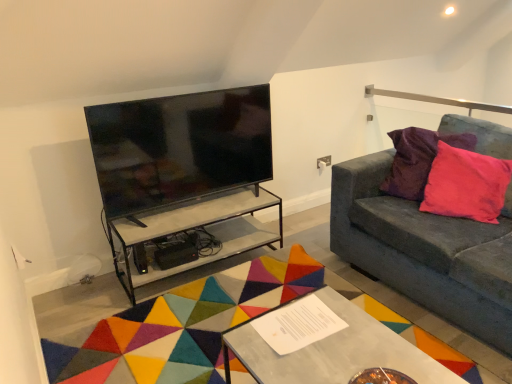
What is the approximate height of pink velvet cushion at right?

59.12 centimeters.

The image size is (512, 384). Find the location of `pink velvet cushion at right`. pink velvet cushion at right is located at coordinates (466, 184).

Find the location of a particular element. velvet grey couch at right is located at coordinates (425, 250).

I want to click on multicolored felt mat at center, so click(x=180, y=326).

Measure the distance between pink velvet pillow at right and camera.

A distance of 2.43 meters exists between pink velvet pillow at right and camera.

Find the location of a particular element. The image size is (512, 384). white paper at center is located at coordinates [x=298, y=324].

What do you see at coordinates (179, 147) in the screenshot? I see `black glossy tv at upper left` at bounding box center [179, 147].

At what (x,y) coordinates should I click in order to perform the action: click on pink velvet cushion at right. Please return your answer as a coordinate pair (x, y). Image resolution: width=512 pixels, height=384 pixels. Looking at the image, I should click on (466, 184).

Is pink velvet cushion at right taller than black glossy tv at upper left?

No, pink velvet cushion at right is not taller than black glossy tv at upper left.

Is pink velvet cushion at right positioned before black glossy tv at upper left?

No, pink velvet cushion at right is further to the viewer.

Identify the location of throw pillow below the black glossy tv at upper left (from a real-world perspective). This screenshot has width=512, height=384. (466, 184).

Are pink velvet cushion at right and black glossy tv at upper left far apart?

pink velvet cushion at right is far away from black glossy tv at upper left.

From a real-world perspective, is metallic silver table at center, which is the first table in front-to-back order, physically located above or below multicolored felt mat at center?

From a real-world perspective, metallic silver table at center, which is the first table in front-to-back order, is physically above multicolored felt mat at center.

From the picture: From the image's perspective, is metallic silver table at center, which is the first table in front-to-back order, located above or below multicolored felt mat at center?

Based on their image positions, metallic silver table at center, which is the first table in front-to-back order, is located above multicolored felt mat at center.

Considering the sizes of objects metallic silver table at center, the second table viewed from the back, and multicolored felt mat at center in the image provided, who is shorter, metallic silver table at center, the second table viewed from the back, or multicolored felt mat at center?

With less height is multicolored felt mat at center.

Is metallic silver table at center, which is the first table in front-to-back order, positioned with its back to multicolored felt mat at center?

Yes.

Does multicolored felt mat at center appear on the left side of clear glass table at center, which appears as the first table when viewed from the back?

In fact, multicolored felt mat at center is to the right of clear glass table at center, which appears as the first table when viewed from the back.

Is multicolored felt mat at center not close to clear glass table at center, the 2th table viewed from the front?

multicolored felt mat at center is near clear glass table at center, the 2th table viewed from the front, not far away.

Considering the relative sizes of multicolored felt mat at center and clear glass table at center, the 2th table viewed from the front, in the image provided, is multicolored felt mat at center shorter than clear glass table at center, the 2th table viewed from the front,?

Correct, multicolored felt mat at center is not as tall as clear glass table at center, the 2th table viewed from the front.

Which is in front, multicolored felt mat at center or clear glass table at center, which appears as the first table when viewed from the back?

multicolored felt mat at center.

Looking at this image, considering the positions of objects multicolored felt mat at center and black glossy tv at upper left in the image provided, who is in front, multicolored felt mat at center or black glossy tv at upper left?

multicolored felt mat at center is in front.

In the image, there is a black glossy tv at upper left. Identify the location of mat below it (from the image's perspective). (180, 326).

Is multicolored felt mat at center facing away from black glossy tv at upper left?

No.

Would you say multicolored felt mat at center is inside or outside black glossy tv at upper left?

The correct answer is: outside.

From the image's perspective, which object appears higher, white paper at center or black glossy tv at upper left?

black glossy tv at upper left.

Which is in front, white paper at center or black glossy tv at upper left?

white paper at center is closer to the camera.

Is white paper at center positioned beyond the bounds of black glossy tv at upper left?

Yes, white paper at center is outside of black glossy tv at upper left.

What's the angular difference between white paper at center and black glossy tv at upper left's facing directions?

white paper at center and black glossy tv at upper left are facing 89.8 degrees away from each other.

From the picture: Does metallic silver table at center, the second table viewed from the back, have a lesser width compared to velvet grey couch at right?

Yes.

Would you say metallic silver table at center, which is the first table in front-to-back order, is outside velvet grey couch at right?

Absolutely, metallic silver table at center, which is the first table in front-to-back order, is external to velvet grey couch at right.

Could you measure the distance between metallic silver table at center, the second table viewed from the back, and velvet grey couch at right?

The distance of metallic silver table at center, the second table viewed from the back, from velvet grey couch at right is 31.43 inches.

From a real-world perspective, is metallic silver table at center, which is the first table in front-to-back order, physically located above or below velvet grey couch at right?

metallic silver table at center, which is the first table in front-to-back order, is below velvet grey couch at right.

Which of these two, black glossy tv at upper left or clear glass table at center, which appears as the first table when viewed from the back, stands taller?

With more height is black glossy tv at upper left.

From a real-world perspective, is black glossy tv at upper left physically located above or below clear glass table at center, which appears as the first table when viewed from the back?

From a real-world perspective, black glossy tv at upper left is physically above clear glass table at center, which appears as the first table when viewed from the back.

Is black glossy tv at upper left positioned with its back to clear glass table at center, the 2th table viewed from the front?

No.

There is a black glossy tv at upper left. What are the coordinates of `the 1st table below it (from the image's perspective)` in the screenshot? It's located at (199, 227).

This screenshot has height=384, width=512. What are the coordinates of `television above the pink velvet cushion at right (from a real-world perspective)` in the screenshot? It's located at [x=179, y=147].

Identify the location of mat on the left of metallic silver table at center, which is the first table in front-to-back order. (180, 326).

Looking at the image, which one is located further to metallic silver table at center, the second table viewed from the back, white paper at center or velvet grey couch at right?

Among the two, velvet grey couch at right is located further to metallic silver table at center, the second table viewed from the back.

When comparing their distances from pink velvet cushion at right, does pink velvet pillow at right or clear glass table at center, the 2th table viewed from the front, seem closer?

Among the two, pink velvet pillow at right is located nearer to pink velvet cushion at right.

When comparing their distances from velvet grey couch at right, does black glossy tv at upper left or pink velvet cushion at right seem closer?

Among the two, pink velvet cushion at right is located nearer to velvet grey couch at right.

When comparing their distances from multicolored felt mat at center, does pink velvet pillow at right or velvet grey couch at right seem closer?

Based on the image, velvet grey couch at right appears to be nearer to multicolored felt mat at center.

When comparing their distances from white paper at center, does metallic silver table at center, which is the first table in front-to-back order, or pink velvet pillow at right seem further?

pink velvet pillow at right is further to white paper at center.

Which object lies nearer to the anchor point white paper at center, metallic silver table at center, the second table viewed from the back, or multicolored felt mat at center?

metallic silver table at center, the second table viewed from the back, is closer to white paper at center.

Estimate the real-world distances between objects in this image. Which object is closer to white paper at center, pink velvet pillow at right or metallic silver table at center, which is the first table in front-to-back order?

metallic silver table at center, which is the first table in front-to-back order, is positioned closer to the anchor white paper at center.

Based on their spatial positions, is metallic silver table at center, the second table viewed from the back, or black glossy tv at upper left closer to pink velvet pillow at right?

black glossy tv at upper left is closer to pink velvet pillow at right.

Identify the location of pillow located between black glossy tv at upper left and velvet grey couch at right in the left-right direction. The width and height of the screenshot is (512, 384). (417, 159).

Find the location of a particular element. The height and width of the screenshot is (384, 512). square between black glossy tv at upper left and pink velvet pillow at right from left to right is located at coordinates (298, 324).

Find the location of a particular element. square located between metallic silver table at center, the second table viewed from the back, and clear glass table at center, which appears as the first table when viewed from the back, in the depth direction is located at coordinates (298, 324).

Locate an element on the screen. The height and width of the screenshot is (384, 512). square situated between clear glass table at center, the 2th table viewed from the front, and pink velvet pillow at right from left to right is located at coordinates (298, 324).